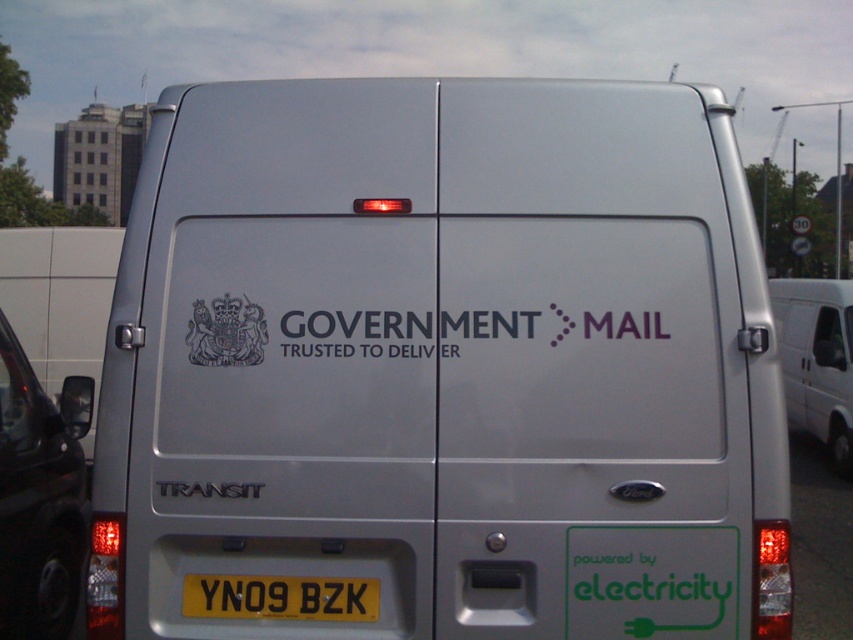
You are a photographer trying to capture the yellow metallic license plate at center clearly in your shot. However, the black glossy car at left is blocking part of the license plate. Can you adjust your position to avoid the obstruction?

The black glossy car at left is bigger than the yellow metallic license plate at center, so moving your camera position to the right side might help avoid the obstruction caused by the larger car.

You are a photographer trying to capture the silver metallic van at center and the white matte government mail logo at center in a single shot. Since the van is closer to you, will the logo appear smaller in your photo compared to the van?

Yes, the silver metallic van at center is closer to the viewer than the white matte government mail logo at center, so the logo will appear smaller in the photo.

You are a delivery person who needs to park your vehicle behind the white matte van at right. According to the image, where should you position your vehicle relative to the white matte government mail logo at center?

The white matte van at right is below the white matte government mail logo at center, so you should park your vehicle below the white matte government mail logo at center to position it behind the white matte van at right.